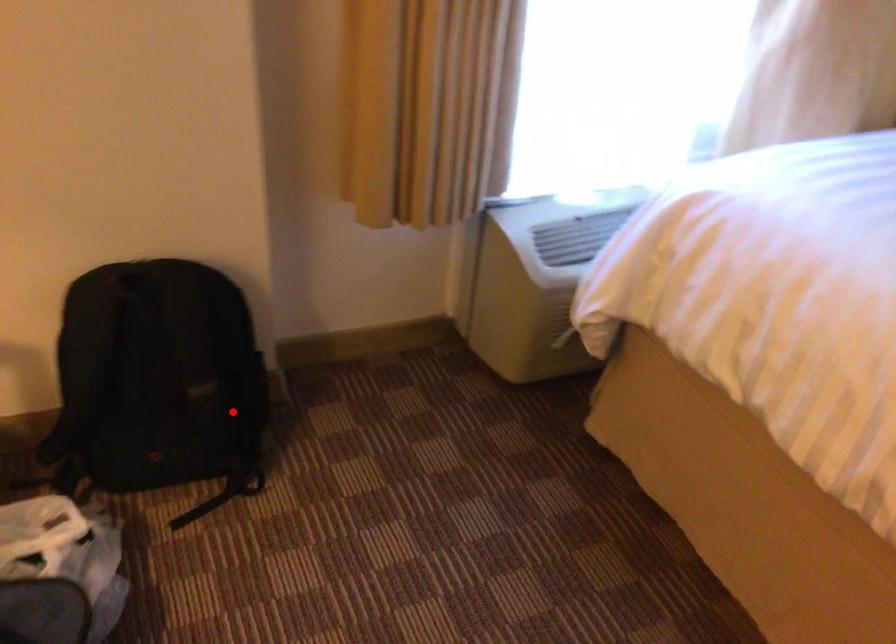
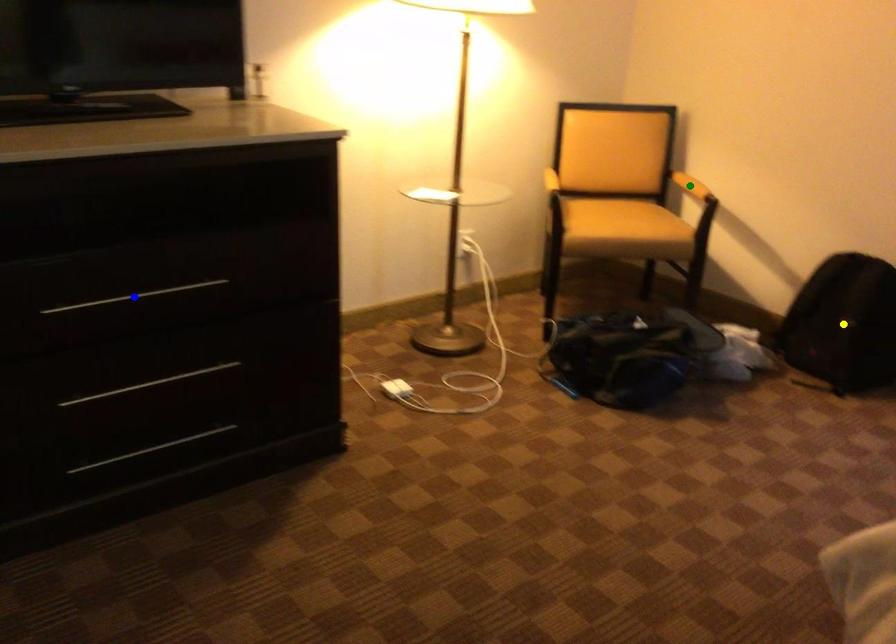
Question: I am providing you with two images of the same scene from different viewpoints. A red point is marked on the first image. You are given multiple points on the second image. Which point in image 2 is actually the same real-world point as the red point in image 1?

Choices:
 (A) green point
 (B) yellow point
 (C) blue point

Answer: (B)